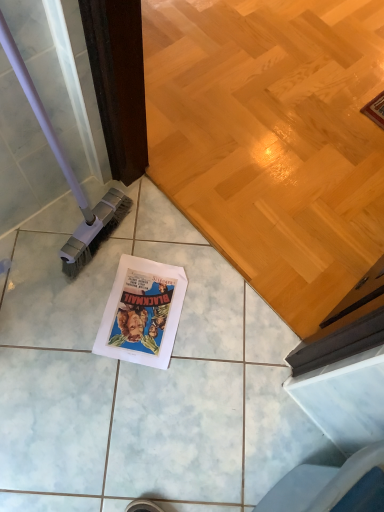
Locate an element on the screen. vacant space situated above white paper comic book at center (from a real-world perspective) is located at coordinates (146, 308).